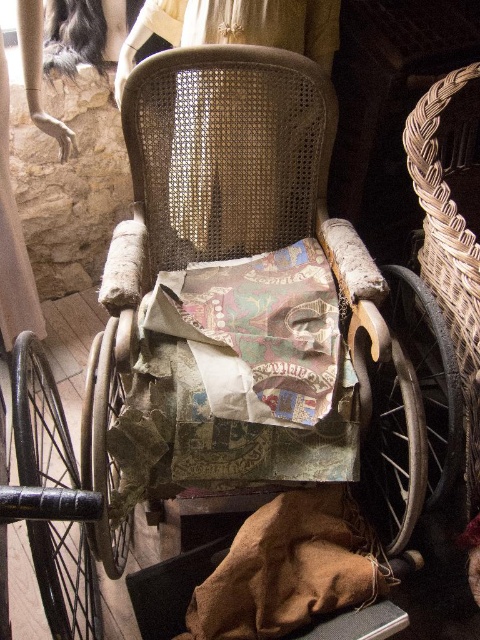
Is point (349, 451) farther from viewer compared to point (456, 106)?

That is False.

Which of these two, worn wood chair at center or woven brown basket at right, stands taller?

With more height is worn wood chair at center.

Who is more distant from viewer, (x=222, y=278) or (x=420, y=147)?

The point (x=222, y=278) is behind.

Where is `worn wood chair at center`? worn wood chair at center is located at coordinates (243, 304).